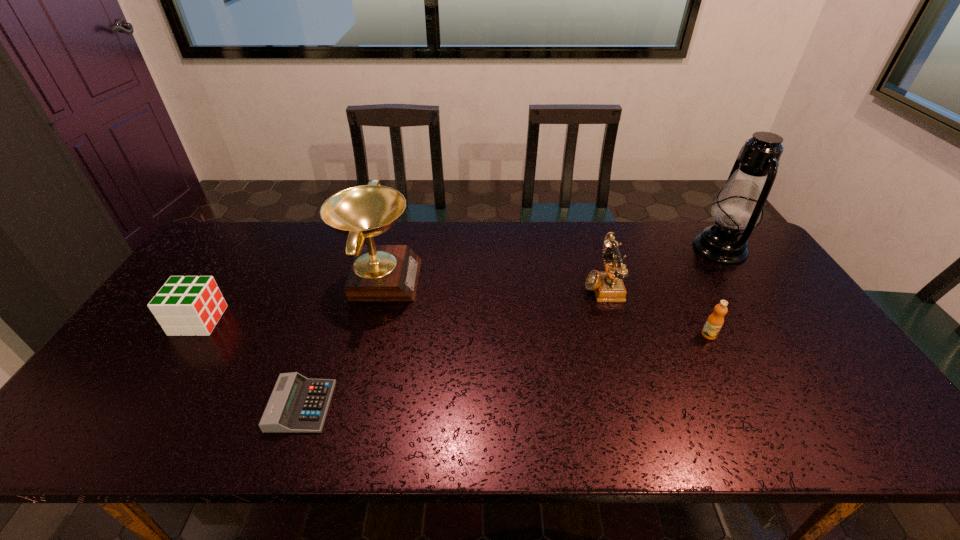
Identify the location of free point that satisfies the following two spatial constraints: 1. on the red face of the cube; 2. on the left side of the nearest object. coord(142,406).

You are a GUI agent. You are given a task and a screenshot of the screen. Output one action in this format:
    pyautogui.click(x=<x>, y=<y>)
    Task: Click on the vacant space that satisfies the following two spatial constraints: 1. on the front side of the tallest object; 2. on the dial number of the fourth object from left to right
    
    Given the screenshot: What is the action you would take?
    pyautogui.click(x=744, y=285)

Where is `blank area in the image that satisfies the following two spatial constraints: 1. on the front side of the tallest object; 2. on the front-facing side of the award`? Image resolution: width=960 pixels, height=540 pixels. blank area in the image that satisfies the following two spatial constraints: 1. on the front side of the tallest object; 2. on the front-facing side of the award is located at coordinates (740, 279).